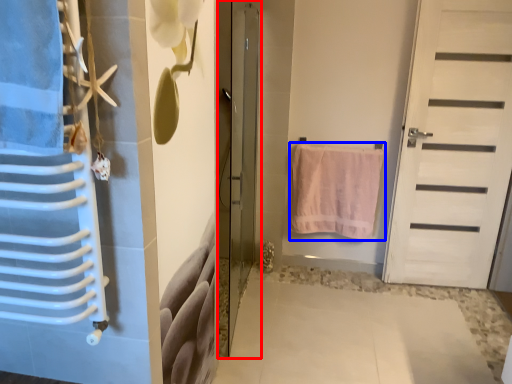
Question: Which object is closer to the camera taking this photo, door (highlighted by a red box) or towel (highlighted by a blue box)?

Choices:
 (A) door
 (B) towel

Answer: (A)